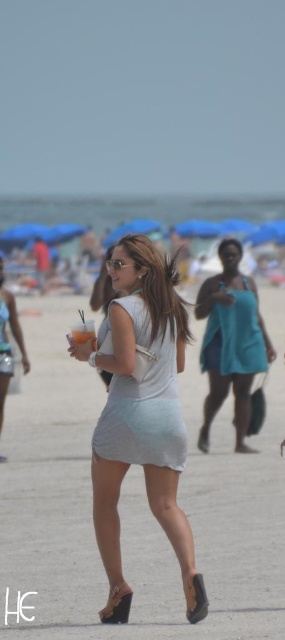
What do you see at coordinates (143, 403) in the screenshot? Image resolution: width=285 pixels, height=640 pixels. I see `light gray fabric dress at center` at bounding box center [143, 403].

Which is above, light gray fabric dress at center or teal matte dress at center?

teal matte dress at center is higher up.

Who is more distant from viewer, (x=139, y=429) or (x=245, y=316)?

The point (x=245, y=316) is more distant.

The image size is (285, 640). What are the coordinates of `light gray fabric dress at center` in the screenshot? It's located at (143, 403).

Does light blue fabric dress at center appear on the right side of light gray fabric dress at center?

In fact, light blue fabric dress at center is to the left of light gray fabric dress at center.

From the picture: Which of these two, light blue fabric dress at center or light gray fabric dress at center, stands shorter?

light gray fabric dress at center

Measure the distance between point (155, 372) and camera.

Point (155, 372) is 10.26 meters from camera.

Where is `light blue fabric dress at center`? light blue fabric dress at center is located at coordinates (141, 417).

Does teal fabric dress at center lie in front of light gray fabric dress at center?

No, teal fabric dress at center is behind light gray fabric dress at center.

Can you confirm if teal fabric dress at center is positioned to the right of light gray fabric dress at center?

Indeed, teal fabric dress at center is positioned on the right side of light gray fabric dress at center.

The width and height of the screenshot is (285, 640). I want to click on teal fabric dress at center, so pyautogui.click(x=231, y=340).

Find the location of `teal fabric dress at center`. teal fabric dress at center is located at coordinates (231, 340).